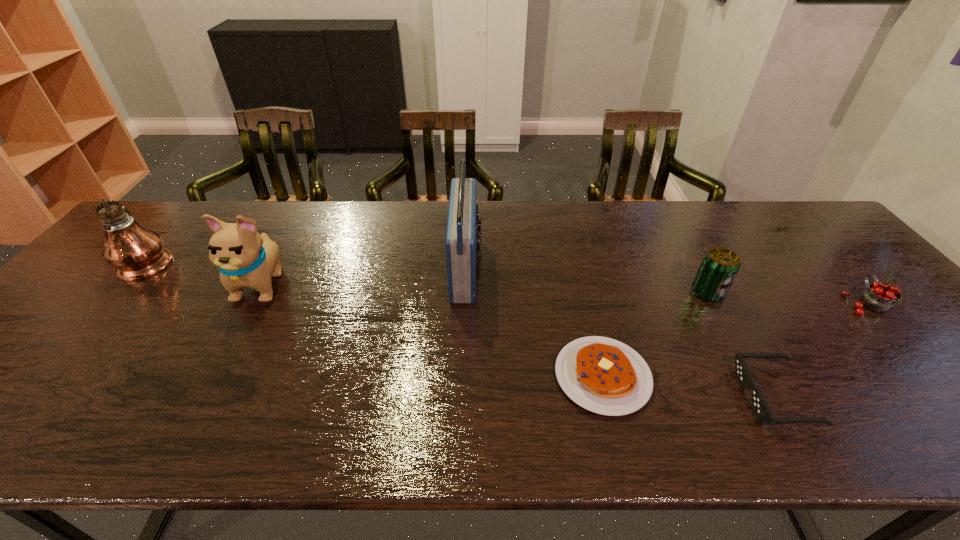
I want to click on oil lamp that is at the far edge, so click(x=137, y=253).

Locate an element on the screen. This screenshot has width=960, height=540. radio receiver that is positioned at the far edge is located at coordinates (462, 242).

Identify the location of pancake present at the near edge. The image size is (960, 540). (603, 375).

Locate an element on the screen. The width and height of the screenshot is (960, 540). sunglasses at the near edge is located at coordinates click(x=759, y=404).

The width and height of the screenshot is (960, 540). Identify the location of object positioned at the left edge. (137, 253).

Image resolution: width=960 pixels, height=540 pixels. Identify the location of object that is at the right edge. (878, 297).

Identify the location of object present at the far left corner. The image size is (960, 540). (137, 253).

In the image, there is a desktop. At what (x,y) coordinates should I click in order to perform the action: click on vacant space at the far edge. Please return your answer as a coordinate pair (x, y). Looking at the image, I should click on (272, 224).

At what (x,y) coordinates should I click in order to perform the action: click on vacant area at the right edge of the desktop. Please return your answer as a coordinate pair (x, y). The width and height of the screenshot is (960, 540). Looking at the image, I should click on (848, 283).

In the image, there is a desktop. At what (x,y) coordinates should I click in order to perform the action: click on vacant region at the far left corner. Please return your answer as a coordinate pair (x, y). Image resolution: width=960 pixels, height=540 pixels. Looking at the image, I should click on click(177, 237).